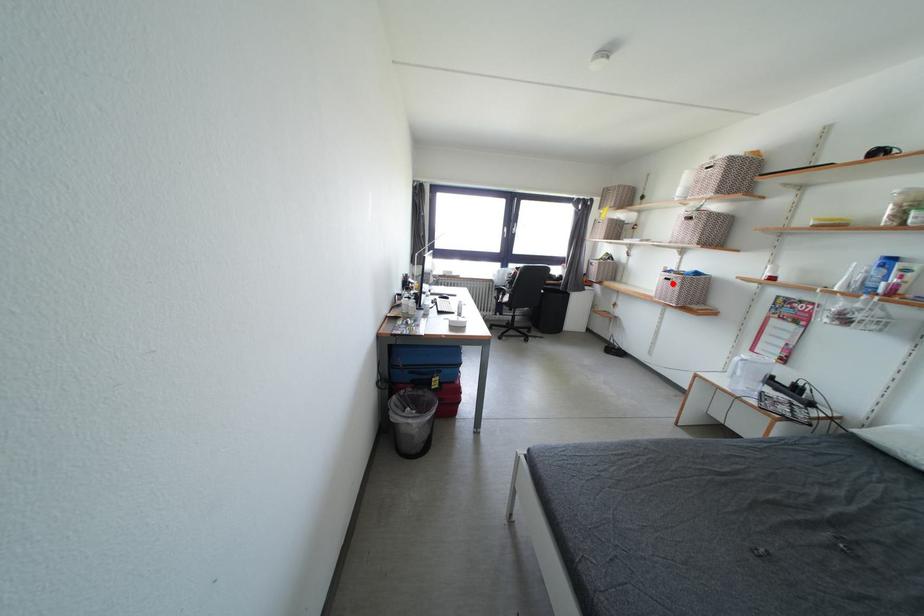
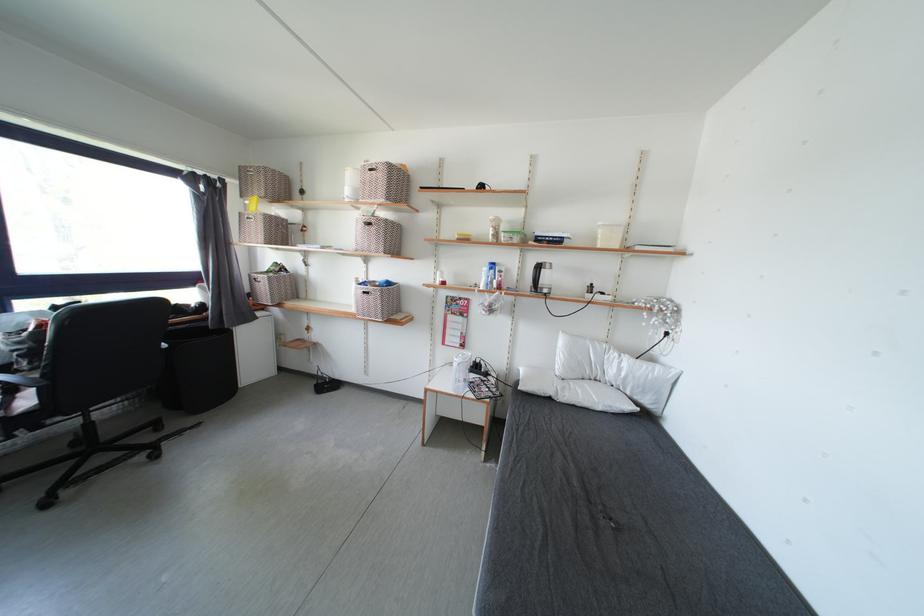
Question: A red point is marked in image1. In image2, is the corresponding 3D point closer to the camera or farther? Reply with the corresponding letter.

Choices:
 (A) The corresponding 3D point is closer.
 (B) The corresponding 3D point is farther.

Answer: (B)